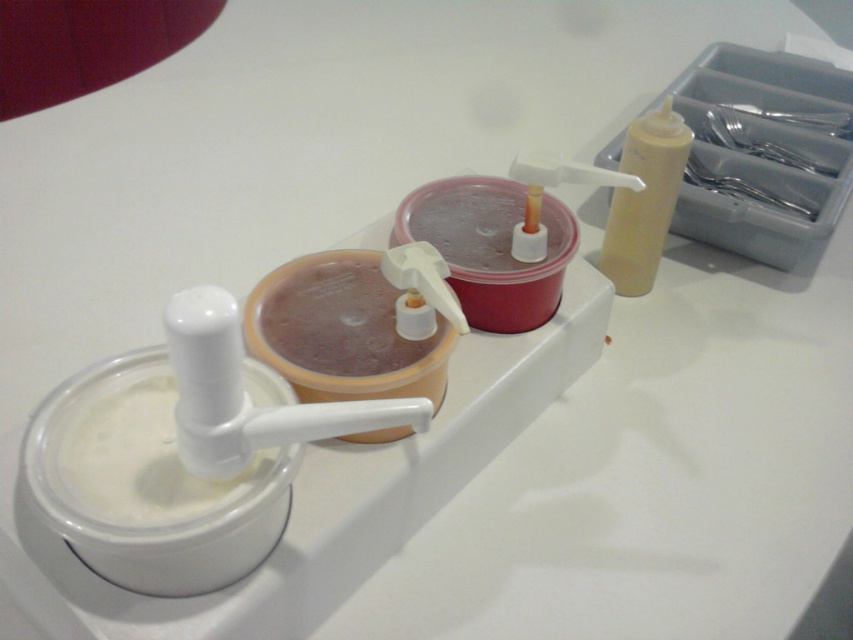
You are setting up a breakfast bar and need to arrange the white matte milk at lower left and the matte yellow squeeze bottle at upper right. According to their current positions, which one is located more to the left?

The white matte milk at lower left is positioned on the left side of the matte yellow squeeze bottle at upper right, so it is more to the left.

You are setting up a small beverage station for a party. You have a white matte milk at lower left and a matte yellow squeeze bottle at upper right. The distance between them is important for accessibility. Can you confirm if the 21.13 inches between them is sufficient for guests to comfortably reach both items without moving their position?

The white matte milk at lower left and the matte yellow squeeze bottle at upper right are 21.13 inches apart from each other. This distance should be sufficient for guests to comfortably reach both items without needing to move their position, as typical comfortable reach ranges are around 18 to 24 inches.

You are a delivery person who needs to pick up the white matte milk at lower left. If your hand is currently 20 inches away from the milk, can you reach it without moving your hand closer?

The white matte milk at lower left and viewer are 20.52 inches apart from each other. Since your hand is 20 inches away, you are close enough to reach it without moving closer.